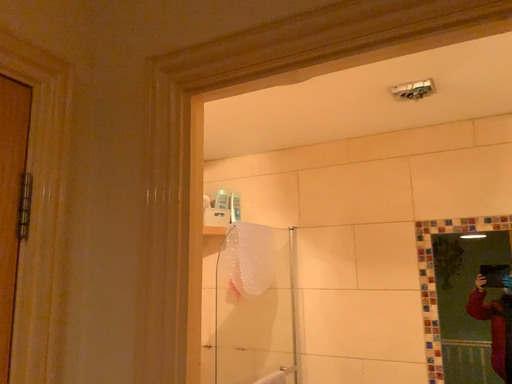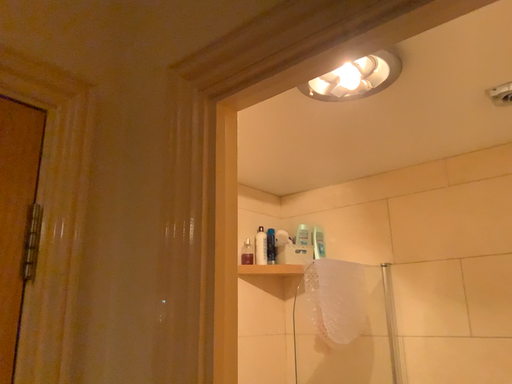
Question: How did the camera likely rotate when shooting the video?

Choices:
 (A) rotated right
 (B) rotated left

Answer: (B)